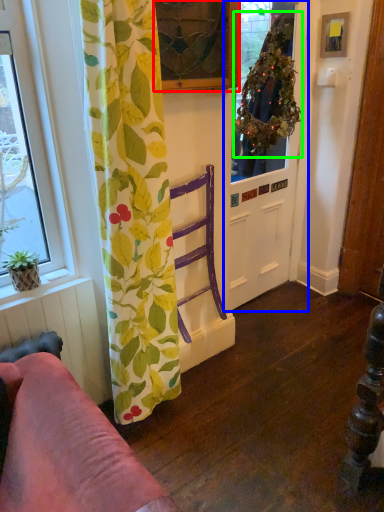
Question: Considering the real-world distances, which object is farthest from window (highlighted by a red box)? door (highlighted by a blue box) or plant (highlighted by a green box)?

Choices:
 (A) door
 (B) plant

Answer: (A)